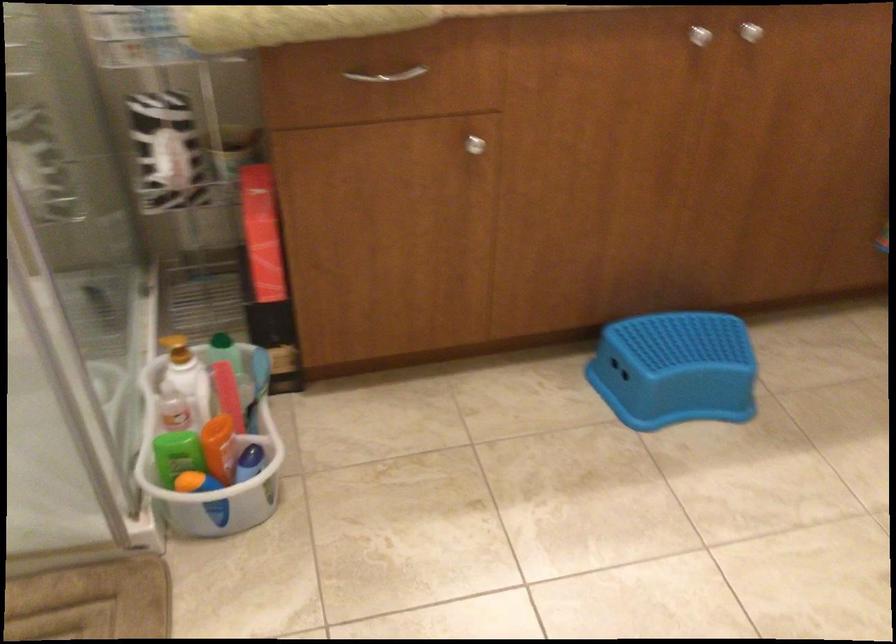
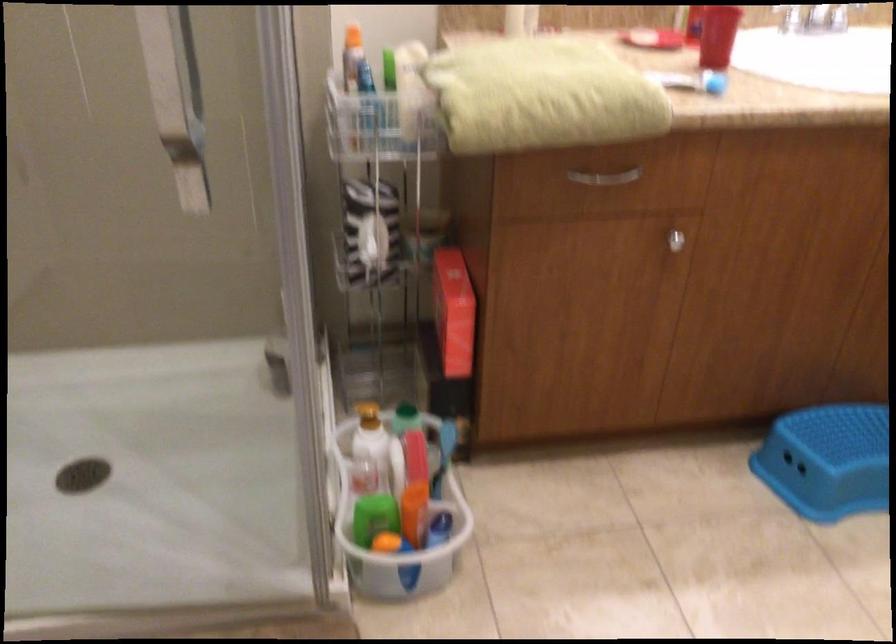
Question: In a continuous first-person perspective shot, in which direction is the camera moving?

Choices:
 (A) Left
 (B) Right
 (C) Forward
 (D) Backward

Answer: (A)